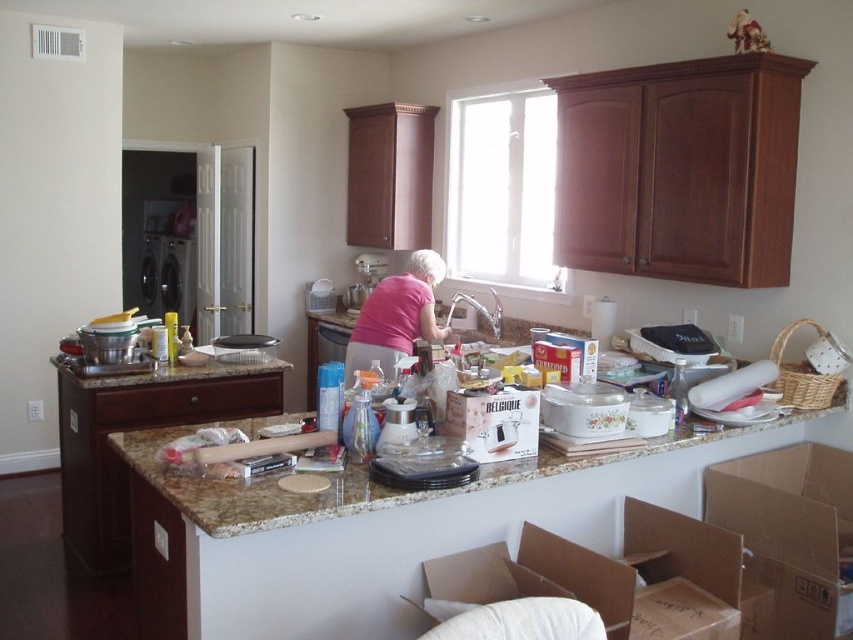
Which is behind, point (839, 449) or point (538, 410)?

The point (839, 449) is more distant.

Where is `brown cardboard box at lower right`? brown cardboard box at lower right is located at coordinates (788, 532).

Find the location of a particular element. brown cardboard box at lower right is located at coordinates (788, 532).

Is pink matte shirt at center closer to the viewer compared to black plastic dishwasher at left?

That is True.

Is pink matte shirt at center to the right of black plastic dishwasher at left from the viewer's perspective?

Yes, pink matte shirt at center is to the right of black plastic dishwasher at left.

Where is `pink matte shirt at center`? The height and width of the screenshot is (640, 853). pink matte shirt at center is located at coordinates (396, 316).

You are a GUI agent. You are given a task and a screenshot of the screen. Output one action in this format:
    pyautogui.click(x=<x>, y=<y>)
    Task: Click on the pink matte shirt at center
    
    Given the screenshot: What is the action you would take?
    pyautogui.click(x=396, y=316)

Between brown cardboard box at lower right and granite countertop at center, which one appears on the left side from the viewer's perspective?

From the viewer's perspective, granite countertop at center appears more on the left side.

Identify the location of brown cardboard box at lower right. This screenshot has height=640, width=853. (788, 532).